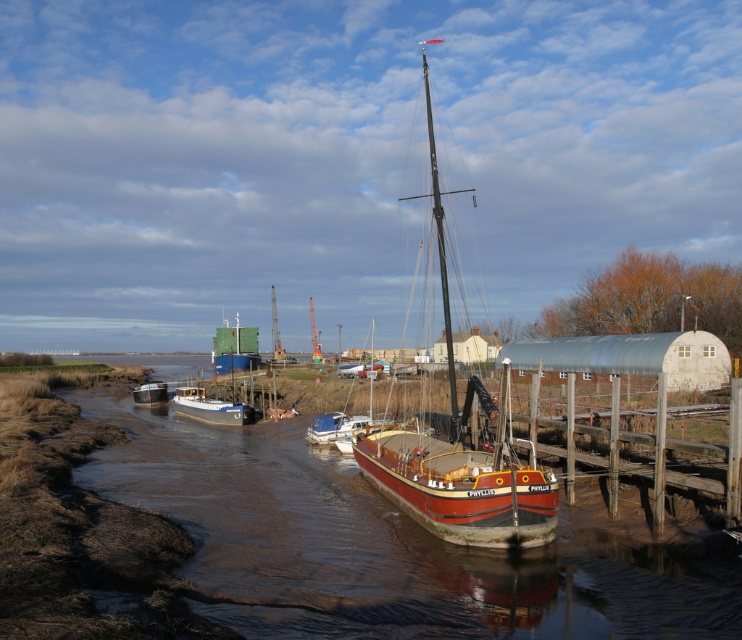
You are an observer standing on the wooden pier where the wooden sailboat at center and white plastic dinghy at center are docked. Which boat would require more space to maneuver around due to its size?

The wooden sailboat at center is larger in size than the white plastic dinghy at center, so it would require more space to maneuver around.

You are standing at the origin point of the image coordinate system, which is the bottom left corner. You want to locate the wooden sailboat at center. What are its coordinates?

The wooden sailboat at center is located at coordinates (459, 451).